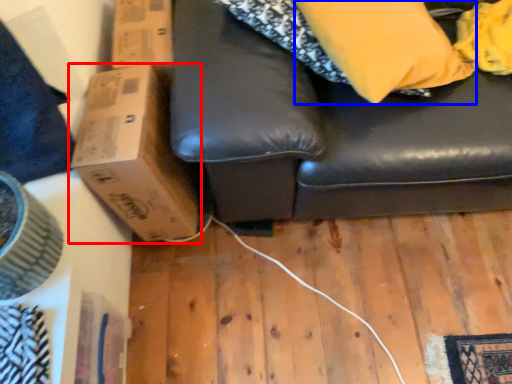
Question: Among these objects, which one is nearest to the camera, cardboard box (highlighted by a red box) or pillow (highlighted by a blue box)?

Choices:
 (A) cardboard box
 (B) pillow

Answer: (B)